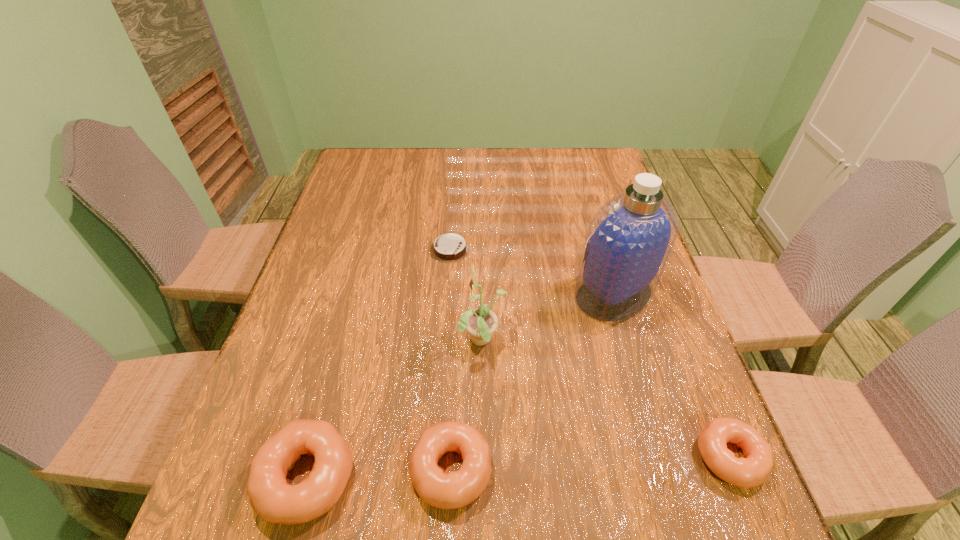
To achieve even spacing by inserting another doughnut among them, please point to a vacant spot for this new doughnut. Please provide its 2D coordinates. Your answer should be formatted as a tuple, i.e. [(x, y)], where the tuple contains the x and y coordinates of a point satisfying the conditions above.

[(592, 463)]